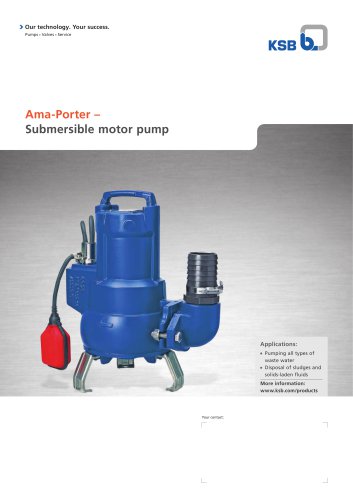
Find the location of a particular element. stand legs is located at coordinates (169, 361), (86, 369).